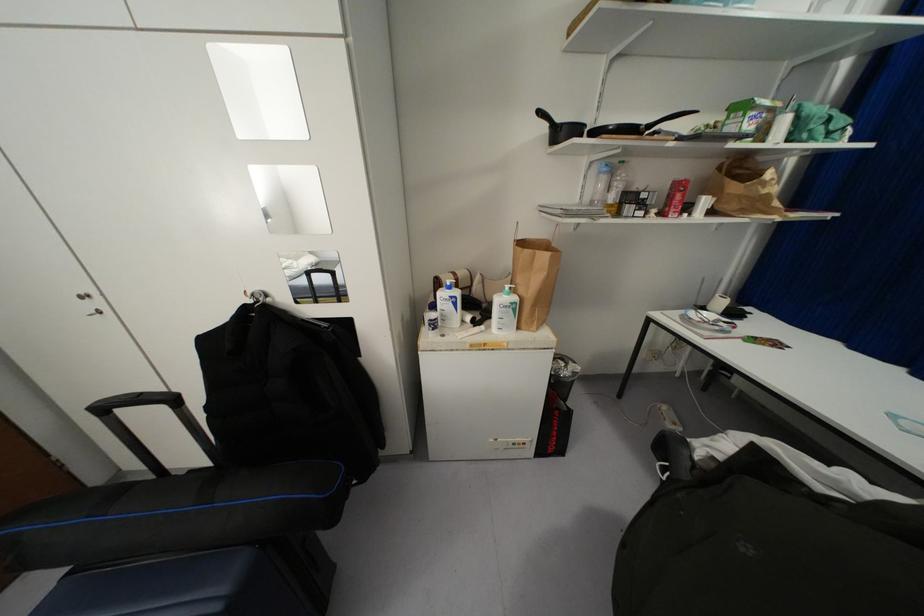
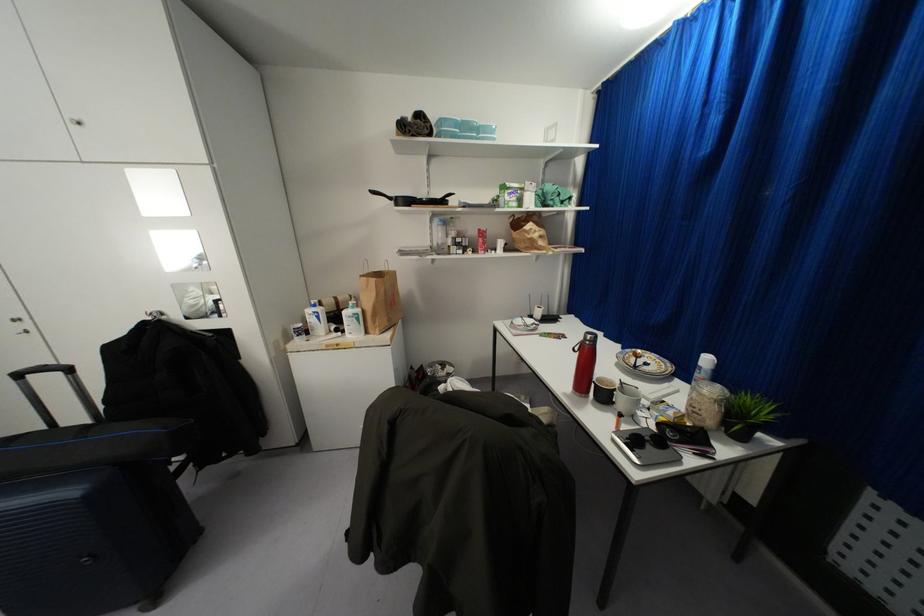
Question: Based on the continuous images, in which direction is the camera rotating? Reply with the corresponding letter.

Choices:
 (A) Left
 (B) Right
 (C) Up
 (D) Down

Answer: (C)